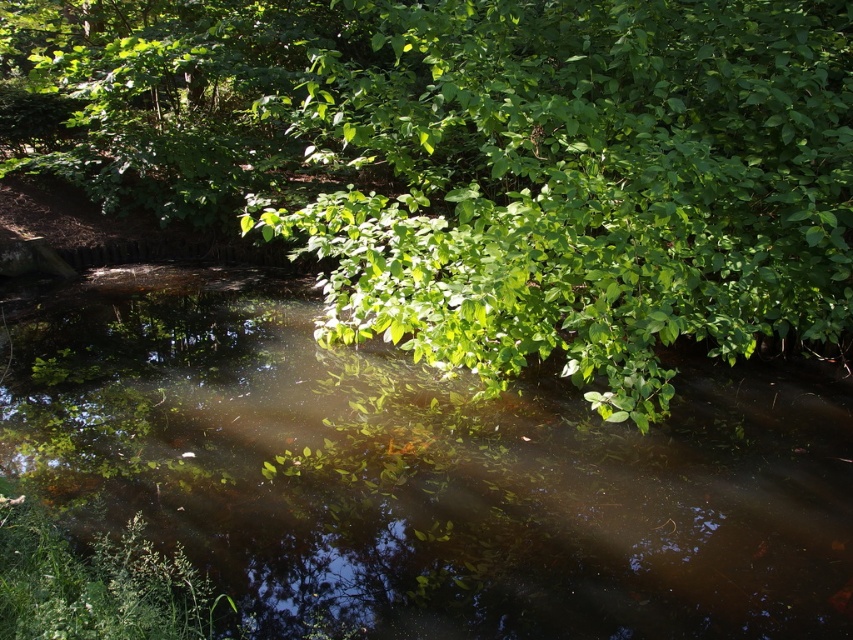
Is point (538, 317) less distant than point (152, 336)?

Yes, point (538, 317) is in front of point (152, 336).

This screenshot has width=853, height=640. What are the coordinates of `green leafy tree at center` in the screenshot? It's located at (489, 163).